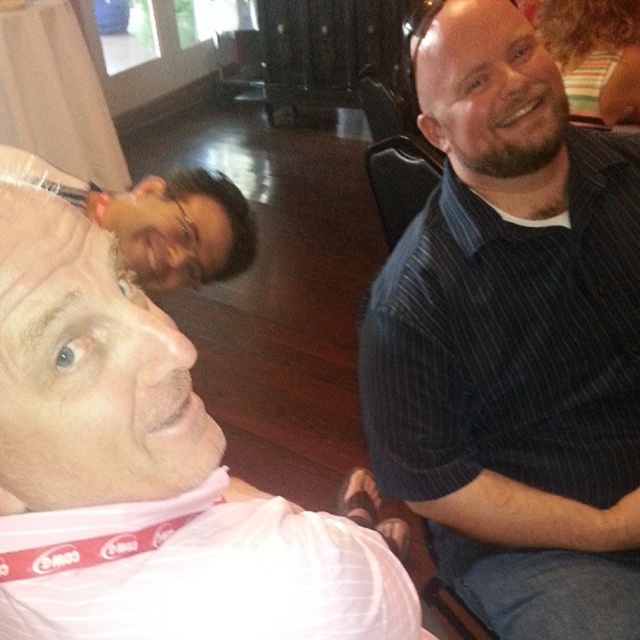
Question: Which point is farther to the camera?

Choices:
 (A) dark brown hair at upper left
 (B) pink fabric shirt at lower left
 (C) dark blue striped shirt at right

Answer: (A)

Question: Among these points, which one is farthest from the camera?

Choices:
 (A) (4, 438)
 (B) (536, 141)
 (C) (472, 292)
 (D) (205, 195)

Answer: (D)

Question: Is pink fabric shirt at lower left to the left of dark blue striped shirt at upper right from the viewer's perspective?

Choices:
 (A) no
 (B) yes

Answer: (B)

Question: Does dark blue striped shirt at right lie behind pink fabric shirt at lower left?

Choices:
 (A) no
 (B) yes

Answer: (B)

Question: Which object is closer to the camera taking this photo?

Choices:
 (A) pink fabric shirt at lower left
 (B) dark blue striped shirt at upper right

Answer: (A)

Question: Can you confirm if dark blue striped shirt at right is smaller than dark brown hair at upper left?

Choices:
 (A) no
 (B) yes

Answer: (A)